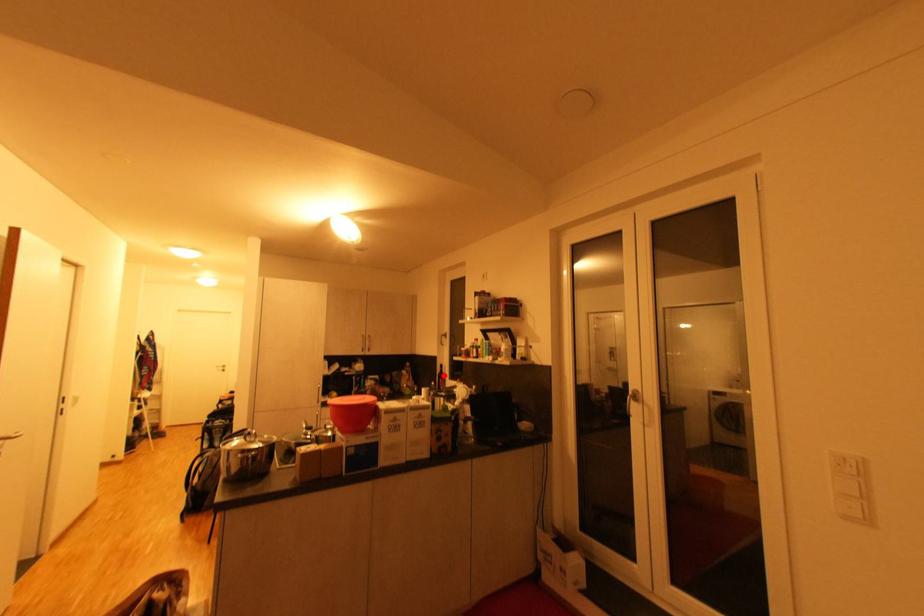
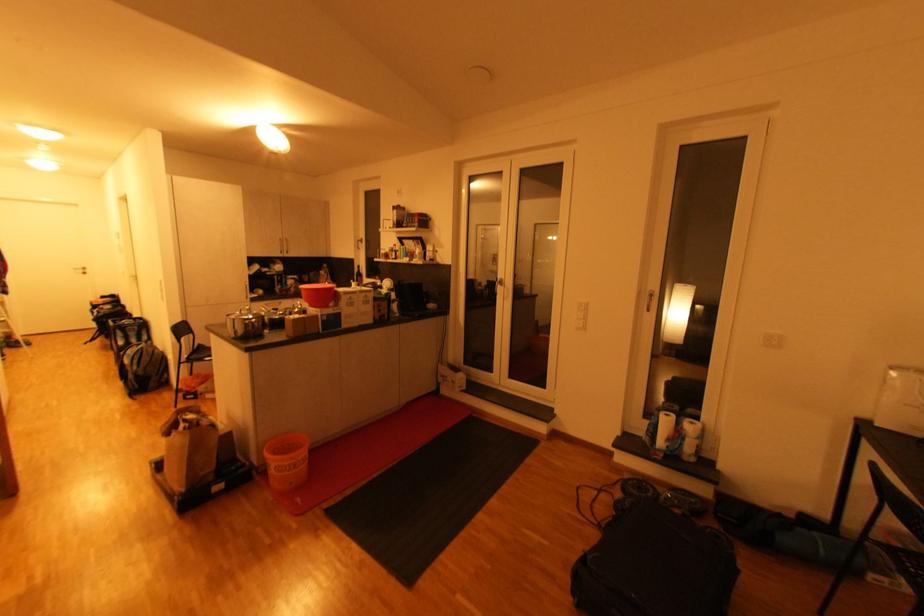
Where in the second image is the point corresponding to the highlighted location from the first image?

(361, 275)